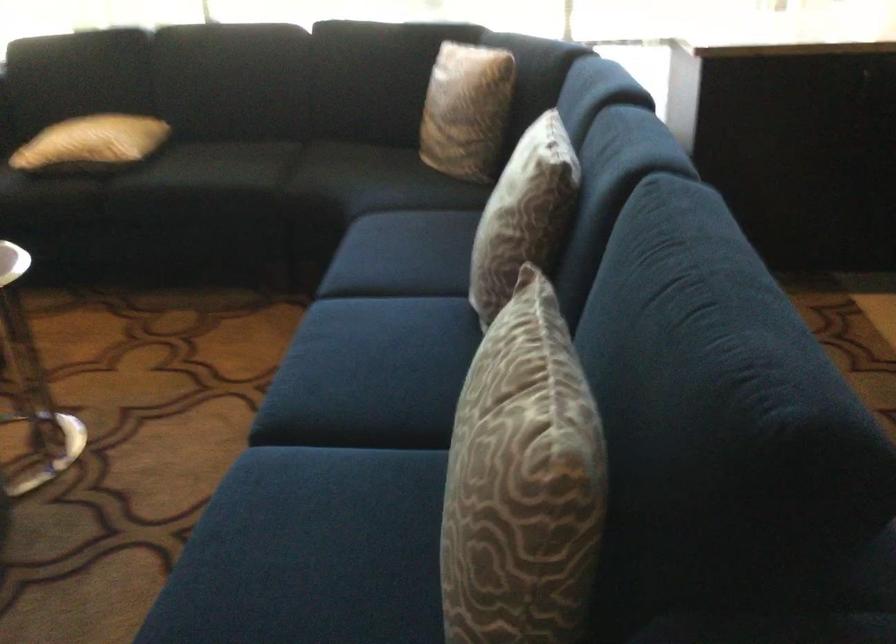
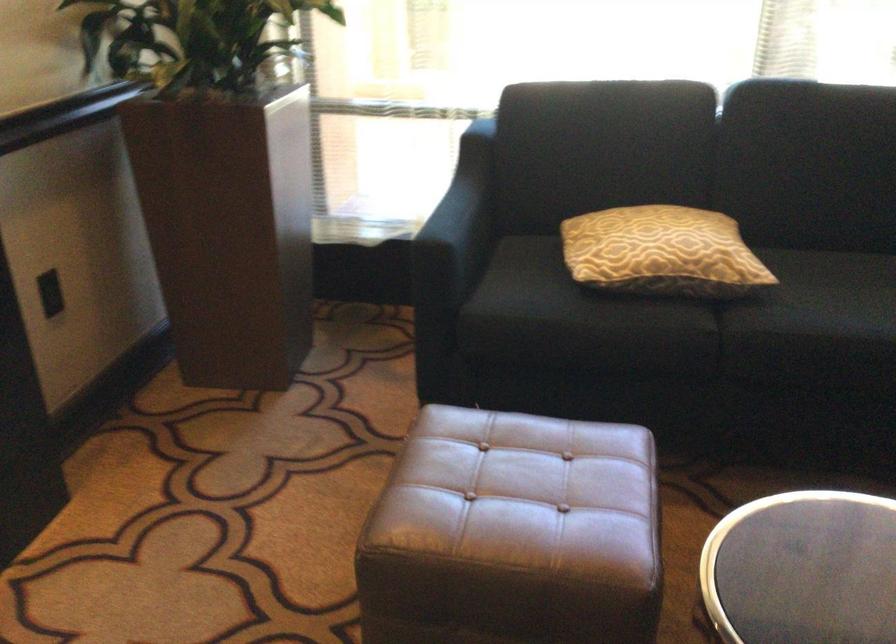
The point at (133, 164) is marked in the first image. Where is the corresponding point in the second image?

(752, 289)